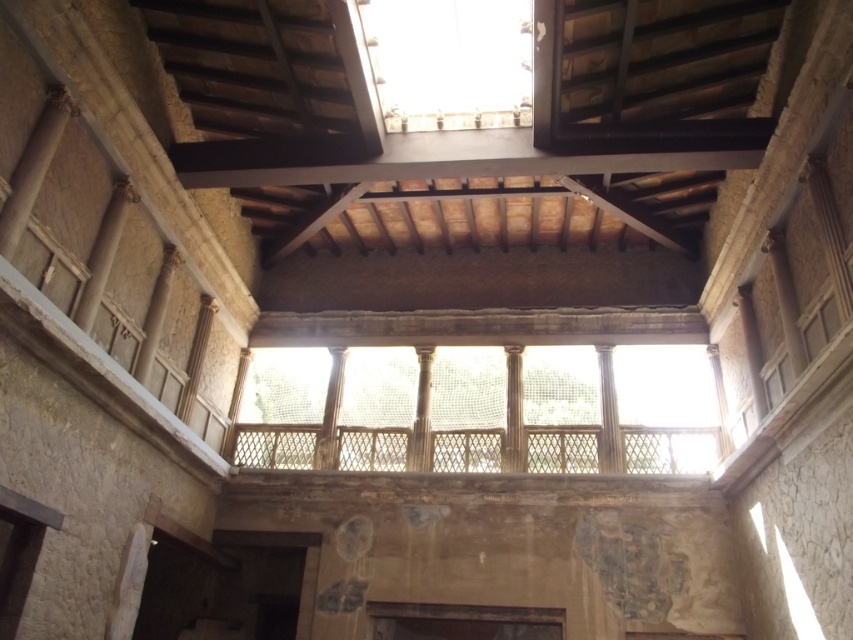
You are an architect visiting this ancient Roman building and want to measure the distance between you and the translucent wooden lattice at center. Can you estimate how far it is from your current position?

The translucent wooden lattice at center is 91.06 feet away from the viewer.

You are an architect examining the ancient Roman building. You notice the translucent wooden lattice at center and the transparent glass window at upper center. Which object is closer to your current position?

The translucent wooden lattice at center is closer to you than the transparent glass window at upper center because it is further to the viewer.

You are standing in the ancient Roman building and want to locate the translucent wooden lattice at center. According to the coordinates provided, where exactly should you look?

The translucent wooden lattice at center is located at coordinates point (479, 410).